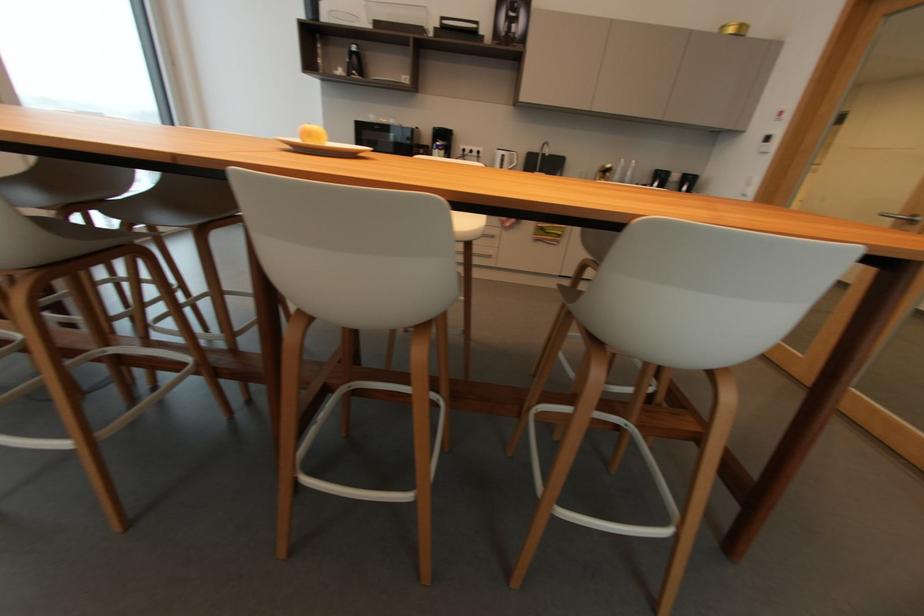
Image resolution: width=924 pixels, height=616 pixels. Describe the element at coordinates (323, 148) in the screenshot. I see `a small white plate` at that location.